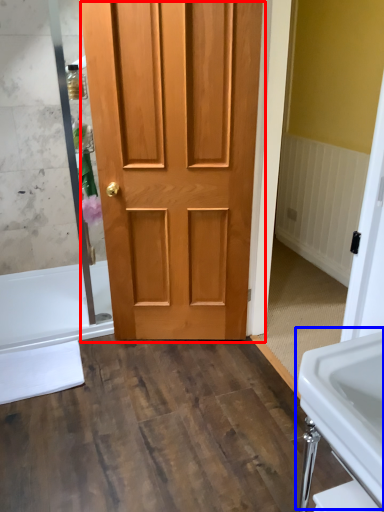
Question: Among these objects, which one is farthest to the camera, door (highlighted by a red box) or sink (highlighted by a blue box)?

Choices:
 (A) door
 (B) sink

Answer: (A)